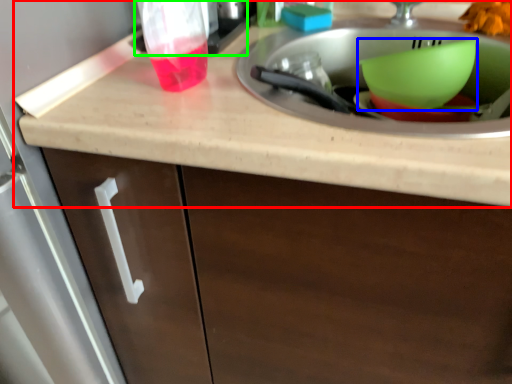
Question: Which object is positioned farthest from countertop (highlighted by a red box)? Select from basin (highlighted by a blue box) and appliance (highlighted by a green box).

Choices:
 (A) basin
 (B) appliance

Answer: (A)